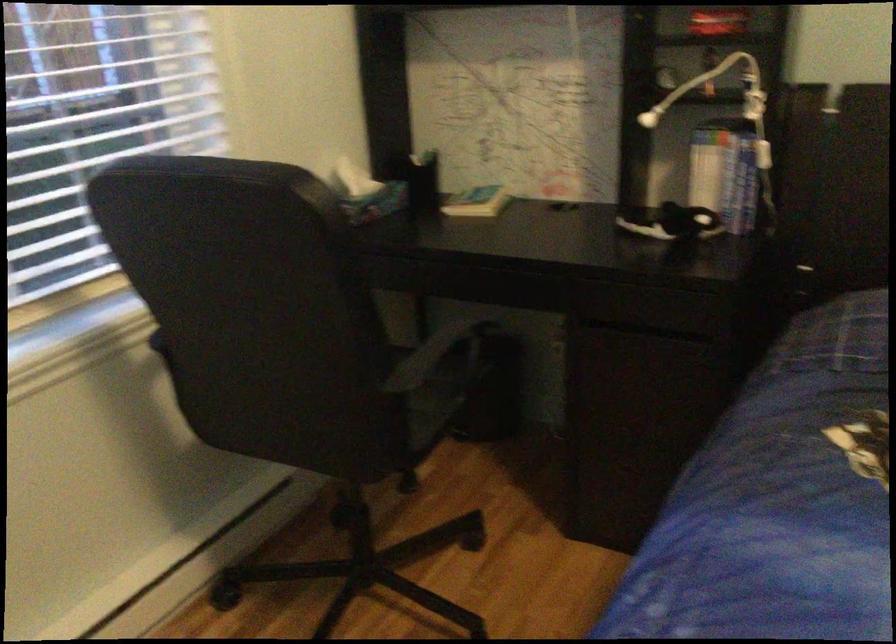
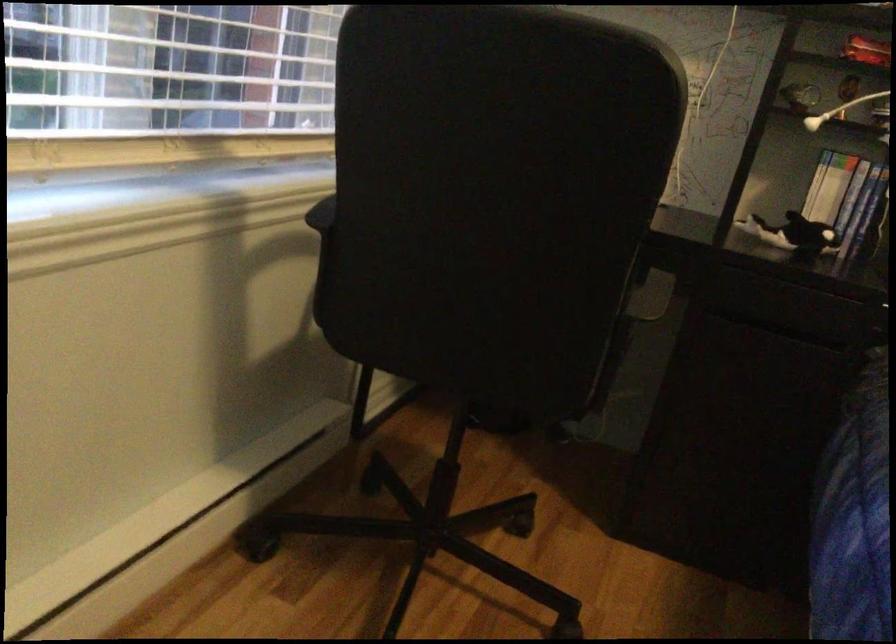
Find the pixel in the second image that matches (x=704, y=80) in the first image.

(839, 109)